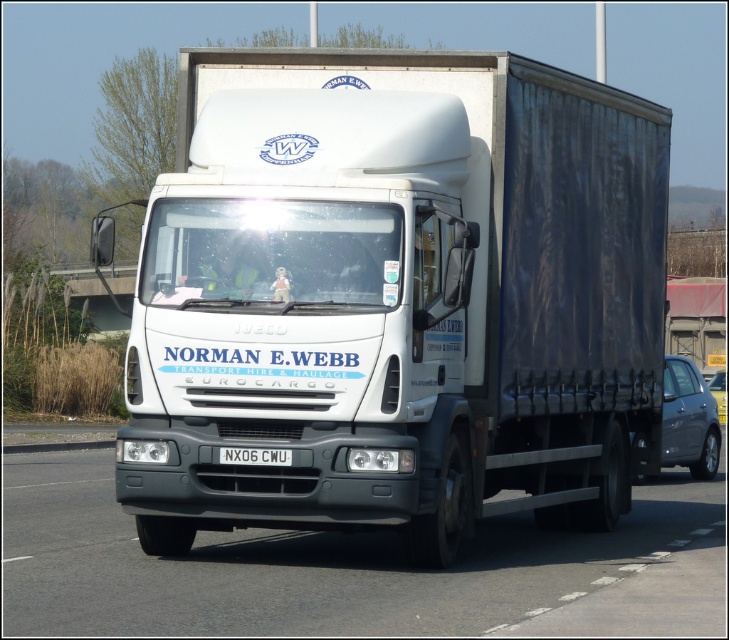
Between point (615, 364) and point (477, 612), which one is positioned behind?

Positioned behind is point (615, 364).

Can you confirm if white matte trailer truck at center is wider than white glossy truck at center?

No, white matte trailer truck at center is not wider than white glossy truck at center.

Image resolution: width=729 pixels, height=640 pixels. Describe the element at coordinates (397, 298) in the screenshot. I see `white matte trailer truck at center` at that location.

Where is `white matte trailer truck at center`? white matte trailer truck at center is located at coordinates (397, 298).

This screenshot has height=640, width=729. What are the coordinates of `satin grey car at right` in the screenshot? It's located at (687, 419).

Does satin grey car at right have a greater height compared to white plastic license plate at center?

Yes.

Find the location of a particular element. Image resolution: width=729 pixels, height=640 pixels. satin grey car at right is located at coordinates [x=687, y=419].

Locate an element on the screen. This screenshot has height=640, width=729. satin grey car at right is located at coordinates (687, 419).

Is white glossy truck at center to the right of satin grey car at right from the viewer's perspective?

Incorrect, white glossy truck at center is not on the right side of satin grey car at right.

Does point (327, 589) come farther from viewer compared to point (666, 444)?

No, it is in front of (666, 444).

Where is `white glossy truck at center`? The width and height of the screenshot is (729, 640). white glossy truck at center is located at coordinates (305, 564).